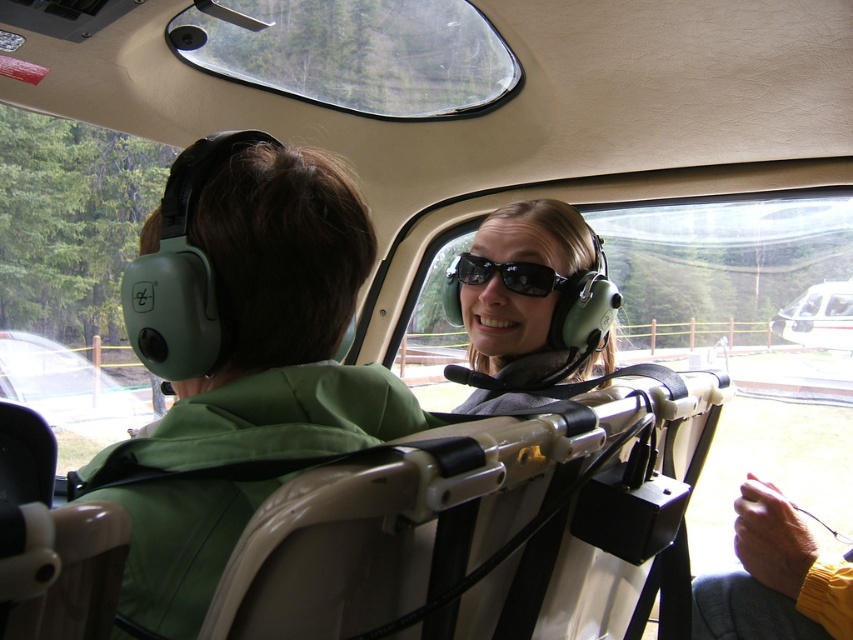
You are standing in the helicopter and want to touch the point at coordinates point [468,323]. Can you reach it without moving your position?

The point at coordinates point [468,323] is 4.77 feet away from the camera, so you can reach it without moving your position since it is within arm reach.

You are a passenger in the helicopter and need to put your backpack between the green matte jacket at center and the white glossy helicopter at center. Can you fit it there?

The green matte jacket at center is shorter than the white glossy helicopter at center, so there is space between them to place the backpack.